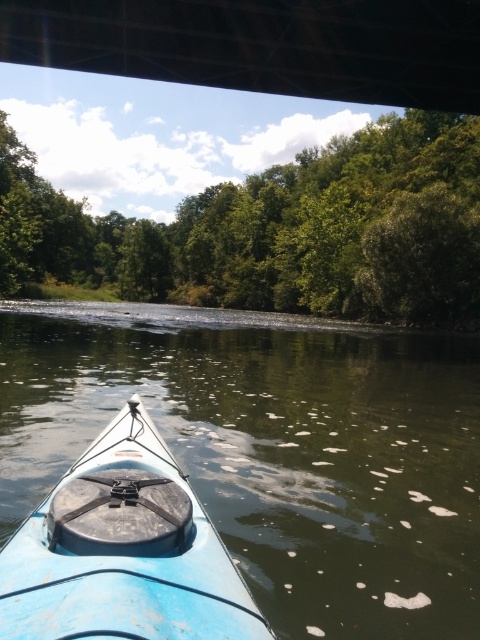
Who is positioned more to the left, green leafy trees at center or dark metal bridge at upper center?

Positioned to the left is green leafy trees at center.

Does green leafy trees at center have a greater height compared to dark metal bridge at upper center?

Yes, green leafy trees at center is taller than dark metal bridge at upper center.

Identify the location of green leafy trees at center. The width and height of the screenshot is (480, 640). (277, 230).

I want to click on blue plastic kayak at lower left, so click(275, 449).

Consider the image. Who is lower down, blue plastic kayak at lower left or light blue plastic kayak at center?

Positioned lower is light blue plastic kayak at center.

Measure the distance between point (x=360, y=387) and camera.

Point (x=360, y=387) and camera are 45.75 feet apart from each other.

You are a GUI agent. You are given a task and a screenshot of the screen. Output one action in this format:
    pyautogui.click(x=<x>, y=<y>)
    Task: Click on the blue plastic kayak at lower left
    
    Given the screenshot: What is the action you would take?
    pyautogui.click(x=275, y=449)

Is blue plastic kayak at lower left taller than dark metal bridge at upper center?

Yes.

Is blue plastic kayak at lower left shorter than dark metal bridge at upper center?

In fact, blue plastic kayak at lower left may be taller than dark metal bridge at upper center.

Does point (360, 378) lie behind point (63, 10)?

Yes, it is behind point (63, 10).

Where is `blue plastic kayak at lower left`? blue plastic kayak at lower left is located at coordinates (275, 449).